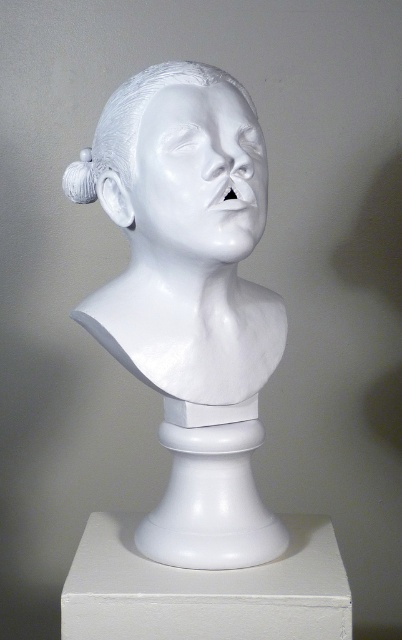
Which is behind, point (270, 609) or point (96, 150)?

Positioned behind is point (96, 150).

Is point (170, 621) positioned after point (131, 112)?

No, (170, 621) is in front of (131, 112).

The width and height of the screenshot is (402, 640). What are the coordinates of `white marble pedestal at center` in the screenshot? It's located at (205, 589).

Can you confirm if white glossy bust at center is wider than white marble pedestal at center?

Incorrect, white glossy bust at center's width does not surpass white marble pedestal at center's.

What do you see at coordinates (190, 298) in the screenshot? I see `white glossy bust at center` at bounding box center [190, 298].

This screenshot has height=640, width=402. In order to click on white glossy bust at center in this screenshot , I will do `click(190, 298)`.

Based on the photo, who is more distant from viewer, (x=293, y=536) or (x=223, y=202)?

The point (x=293, y=536) is more distant.

Does white marble pedestal at center have a greater height compared to white glossy sculpture at center?

In fact, white marble pedestal at center may be shorter than white glossy sculpture at center.

Image resolution: width=402 pixels, height=640 pixels. Identify the location of white marble pedestal at center. (205, 589).

The image size is (402, 640). Identify the location of white marble pedestal at center. (205, 589).